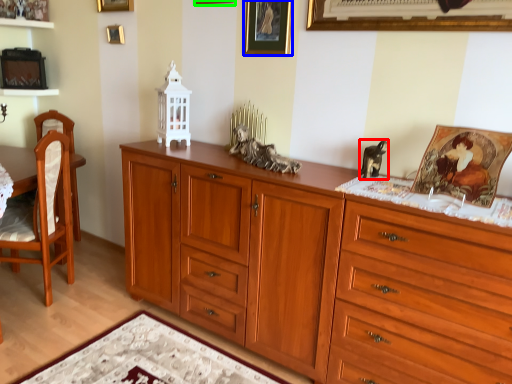
Question: Considering the real-world distances, which object is farthest from animal (highlighted by a red box)? picture frame (highlighted by a blue box) or picture frame (highlighted by a green box)?

Choices:
 (A) picture frame
 (B) picture frame

Answer: (B)